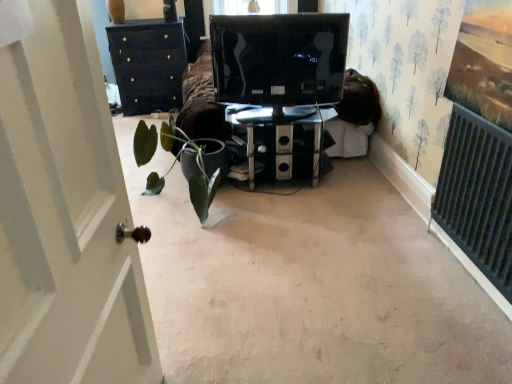
Question: Is transparent glass table at center to the left or to the right of black glossy monitor at center in the image?

Choices:
 (A) left
 (B) right

Answer: (B)

Question: Relative to black glossy monitor at center, is transparent glass table at center in front or behind?

Choices:
 (A) behind
 (B) front

Answer: (A)

Question: Based on their relative distances, which object is farther from the black glossy monitor at center?

Choices:
 (A) transparent glass table at center
 (B) green matte plant at center

Answer: (B)

Question: Estimate the real-world distances between objects in this image. Which object is closer to the black glossy monitor at center?

Choices:
 (A) green matte plant at center
 (B) transparent glass table at center

Answer: (B)